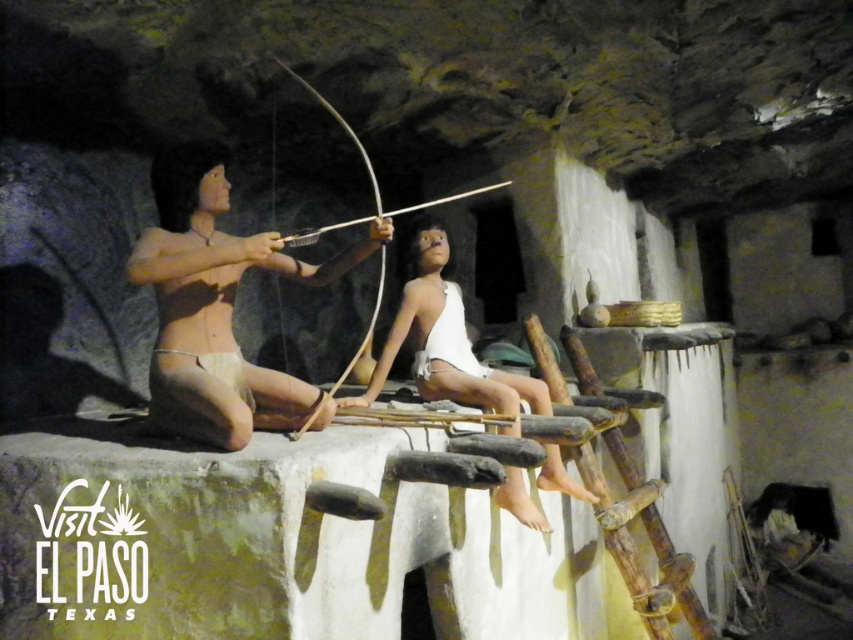
You are a photographer standing in the cave and want to take a closeup photo of the matte tan skin at center. The camera you are using has a minimum focusing distance of 8 feet. Will you be able to take the photo without moving closer?

The matte tan skin at center is 8.55 feet away from the camera. Since the minimum focusing distance is 8 feet, the camera can focus on the matte tan skin at center from this distance, so yes, you can take the closeup photo without moving closer.

You are an archaeologist examining the cave structure. You notice two objects at the center of the scene. Which object is wider, the white matte wood at center or the wooden bow and arrow at center?

The wooden bow and arrow at center is wider than the white matte wood at center.

You are an archaeologist examining the cave structure. You notice two objects at the center of the scene. Which object is positioned higher relative to the other? The options are the matte tan skin at center and the white matte wood at center.

The matte tan skin at center is located above the white matte wood at center, so the matte tan skin at center is positioned higher.